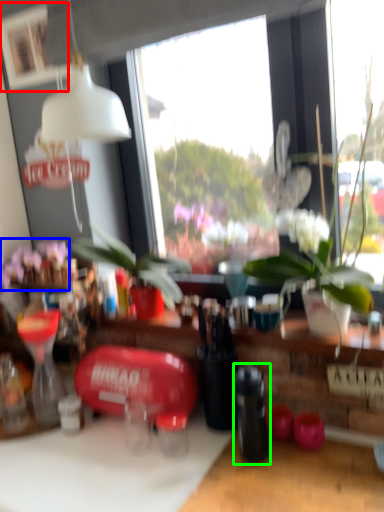
Question: Which is nearer to the picture frame (highlighted by a red box)? flower (highlighted by a blue box) or bottle (highlighted by a green box).

Choices:
 (A) flower
 (B) bottle

Answer: (A)